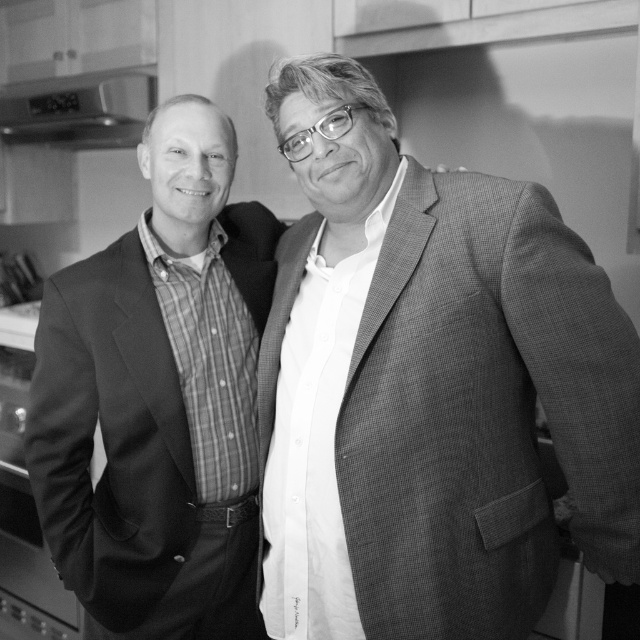
You are a photographer adjusting the camera focus. You need to ensure both the matte black suit at left and the metallic silver exhaust hood at upper left are in focus. Given their sizes, which object should you prioritize focusing on first?

The matte black suit at left is larger in size than the metallic silver exhaust hood at upper left, so you should prioritize focusing on the matte black suit at left first to ensure clarity.

Consider the image. You are a photographer trying to capture a portrait of the two people in the scene. The matte black suit at left and the metallic silver exhaust hood at upper left are both in the frame. If you want to ensure both objects are fully visible in the photo, which one should you focus on to avoid cropping either?

The matte black suit at left is narrower than the metallic silver exhaust hood at upper left. To ensure both are fully visible, focus on the wider metallic silver exhaust hood at upper left since it requires more space in the frame.

You are standing in a kitchen and see the matte black suit at left. If you want to hand them a recipe card, can you reach them without moving closer?

The matte black suit at left and viewer are 1.27 meters apart. Since the average human arm length is about 0.7 meters, you cannot reach them without moving closer.